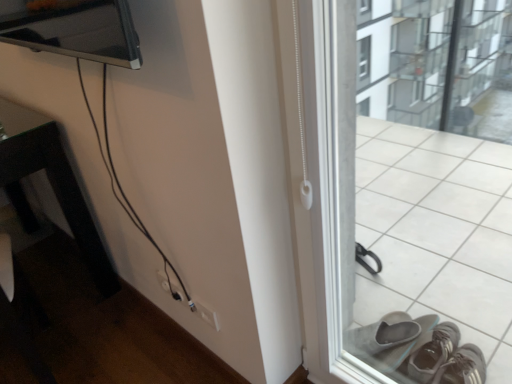
Question: Is white plastic window frame at right wider than black glossy table at left?

Choices:
 (A) no
 (B) yes

Answer: (A)

Question: Does white plastic window frame at right appear on the right side of black glossy table at left?

Choices:
 (A) yes
 (B) no

Answer: (A)

Question: Is white plastic window frame at right at the left side of black glossy table at left?

Choices:
 (A) no
 (B) yes

Answer: (A)

Question: Is white plastic window frame at right far away from black glossy table at left?

Choices:
 (A) yes
 (B) no

Answer: (A)

Question: From the image's perspective, is white plastic window frame at right above black glossy table at left?

Choices:
 (A) no
 (B) yes

Answer: (A)

Question: From their relative heights in the image, would you say white plastic electric outlet at lower center is taller or shorter than white plastic window frame at right?

Choices:
 (A) short
 (B) tall

Answer: (A)

Question: Is white plastic electric outlet at lower center in front of or behind white plastic window frame at right in the image?

Choices:
 (A) front
 (B) behind

Answer: (B)

Question: From a real-world perspective, is white plastic electric outlet at lower center above or below white plastic window frame at right?

Choices:
 (A) below
 (B) above

Answer: (A)

Question: In terms of width, does white plastic electric outlet at lower center look wider or thinner when compared to white plastic window frame at right?

Choices:
 (A) wide
 (B) thin

Answer: (B)

Question: Based on their positions, is white plastic window frame at right located to the left or right of white plastic electric outlet at lower center?

Choices:
 (A) left
 (B) right

Answer: (B)

Question: From the image's perspective, relative to white plastic electric outlet at lower center, is white plastic window frame at right above or below?

Choices:
 (A) below
 (B) above

Answer: (B)

Question: Considering the positions of white plastic window frame at right and white plastic electric outlet at lower center in the image, is white plastic window frame at right taller or shorter than white plastic electric outlet at lower center?

Choices:
 (A) tall
 (B) short

Answer: (A)

Question: From a real-world perspective, is white plastic window frame at right positioned above or below white plastic electric outlet at lower center?

Choices:
 (A) above
 (B) below

Answer: (A)

Question: From the image's perspective, is white plastic window frame at right located above or below black glossy table at left?

Choices:
 (A) below
 (B) above

Answer: (A)

Question: Looking at their shapes, would you say white plastic window frame at right is wider or thinner than black glossy table at left?

Choices:
 (A) thin
 (B) wide

Answer: (A)